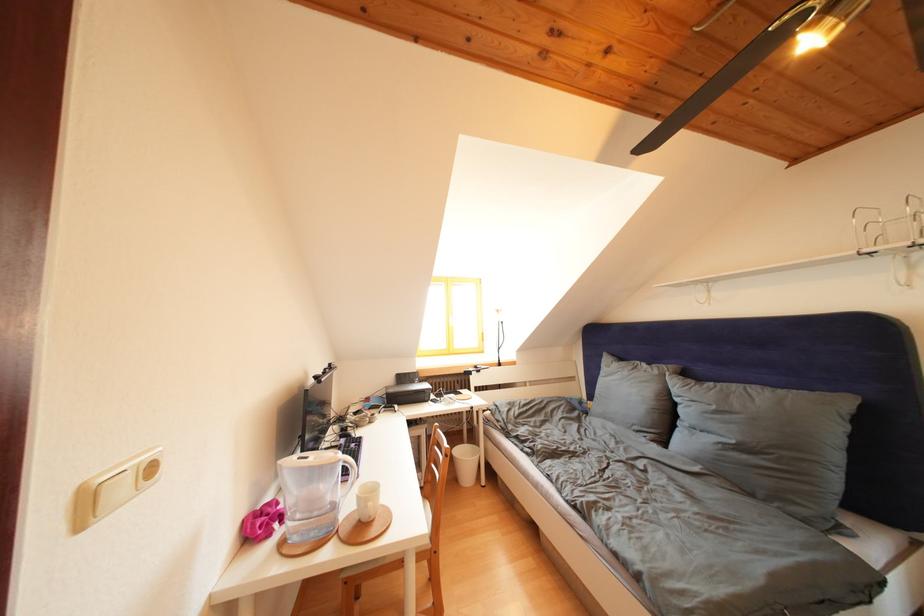
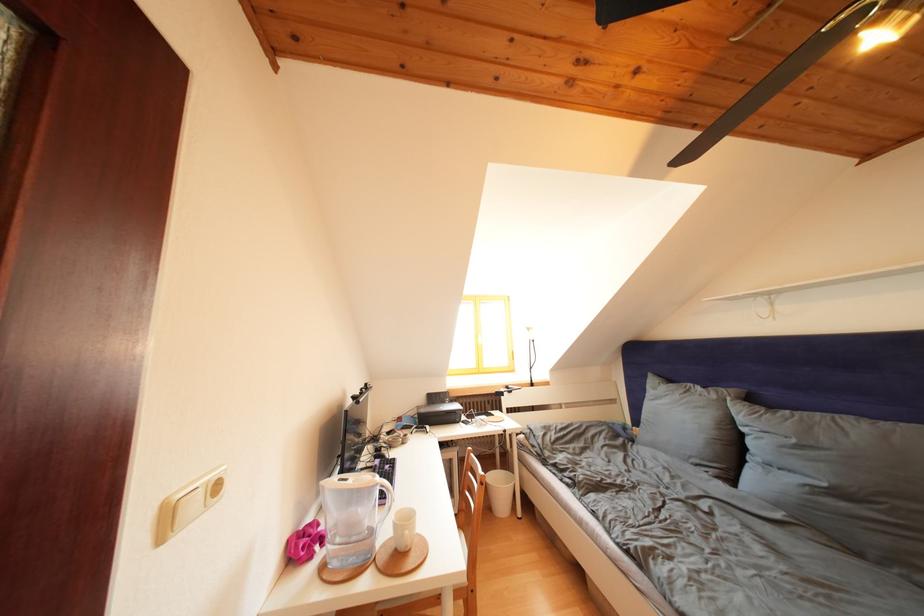
Where in the second image is the point corresponding to (348,459) from the first image?

(385, 482)